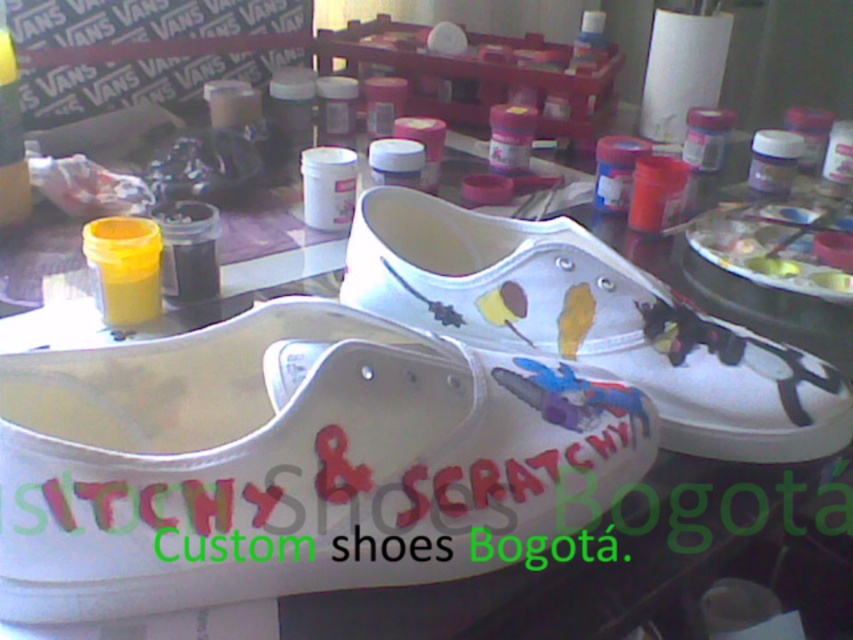
Question: Is hand-painted text at center positioned before white canvas shoe at center?

Choices:
 (A) no
 (B) yes

Answer: (B)

Question: Which of these objects is positioned closest to the white canvas shoe at center?

Choices:
 (A) white matte shoe at center
 (B) hand-painted text at center

Answer: (A)

Question: Does white matte shoe at center come in front of hand-painted text at center?

Choices:
 (A) yes
 (B) no

Answer: (A)

Question: Does hand-painted text at center have a smaller size compared to white canvas shoe at center?

Choices:
 (A) no
 (B) yes

Answer: (B)

Question: Considering the real-world distances, which object is farthest from the white canvas shoe at center?

Choices:
 (A) white matte shoe at center
 (B) hand-painted text at center

Answer: (B)

Question: Estimate the real-world distances between objects in this image. Which object is farther from the white matte shoe at center?

Choices:
 (A) white canvas shoe at center
 (B) hand-painted text at center

Answer: (A)